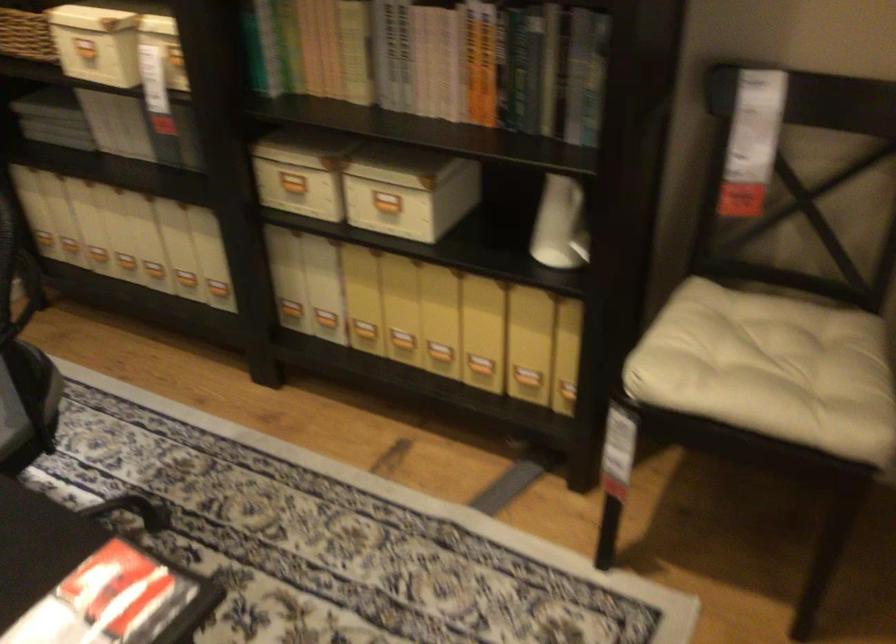
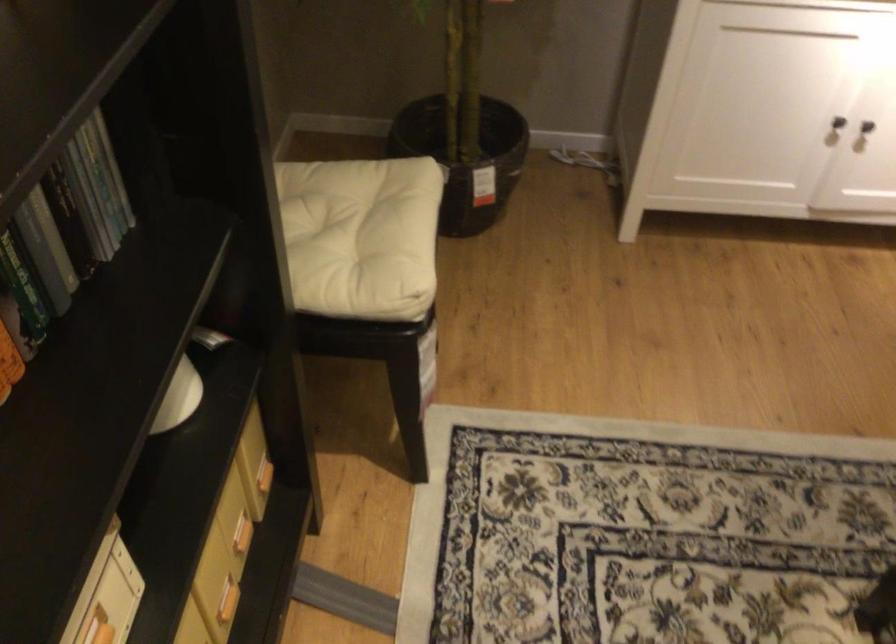
The point at [535,99] is marked in the first image. Where is the corresponding point in the second image?

(22, 288)